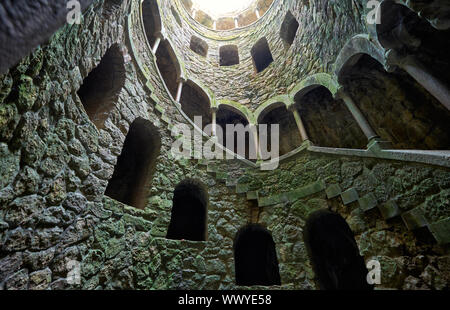
What are the coordinates of `archway in wall` in the screenshot? It's located at (346, 257), (263, 259), (193, 217), (134, 168), (100, 92), (172, 13), (193, 47), (227, 59), (259, 60), (283, 31).